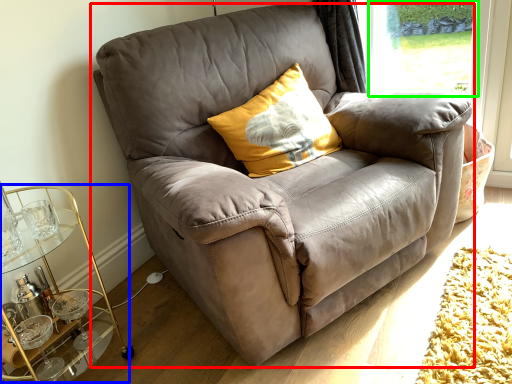
Question: Which object is the closest to the chair (highlighted by a red box)? Choose among these: cocktail table (highlighted by a blue box) or window screen (highlighted by a green box).

Choices:
 (A) cocktail table
 (B) window screen

Answer: (A)